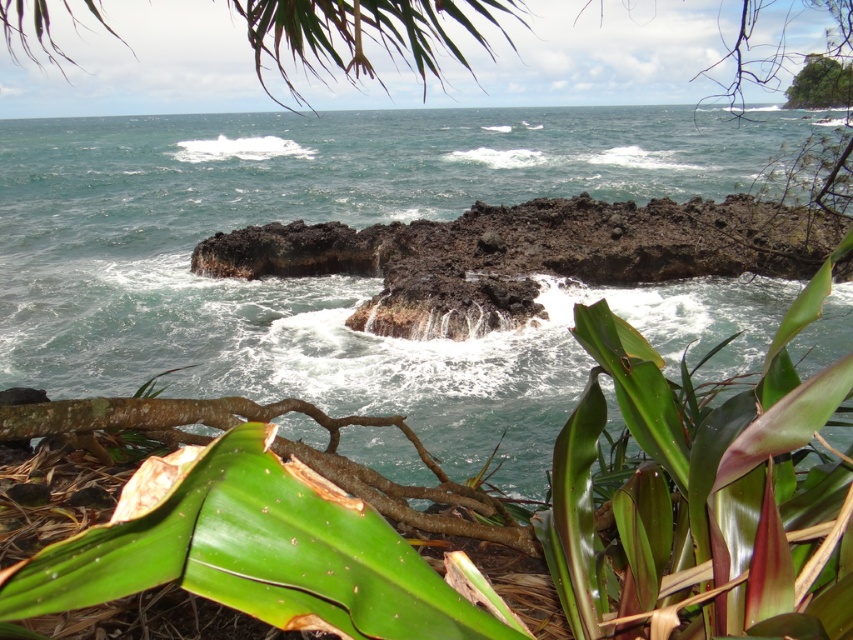
Find the location of a particular element. The width and height of the screenshot is (853, 640). greenish-blue water at center is located at coordinates (351, 276).

Who is higher up, greenish-blue water at center or green leafy bush at upper right?

green leafy bush at upper right is higher up.

Is point (549, 460) farther from camera compared to point (822, 90)?

No, (549, 460) is closer to viewer.

The height and width of the screenshot is (640, 853). Identify the location of greenish-blue water at center. click(x=351, y=276).

Is volcanic rock at center below green leafy bush at upper right?

Yes, volcanic rock at center is below green leafy bush at upper right.

Looking at this image, who is positioned more to the left, volcanic rock at center or green leafy bush at upper right?

volcanic rock at center is more to the left.

The width and height of the screenshot is (853, 640). What are the coordinates of `volcanic rock at center` in the screenshot? It's located at (525, 253).

I want to click on volcanic rock at center, so click(525, 253).

Consider the image. Can you confirm if greenish-blue water at center is positioned above volcanic rock at center?

Yes, greenish-blue water at center is above volcanic rock at center.

What do you see at coordinates (351, 276) in the screenshot? I see `greenish-blue water at center` at bounding box center [351, 276].

Between point (810, 340) and point (717, 273), which one is positioned behind?

The point (717, 273) is more distant.

Find the location of a particular element. This screenshot has width=853, height=640. greenish-blue water at center is located at coordinates (351, 276).